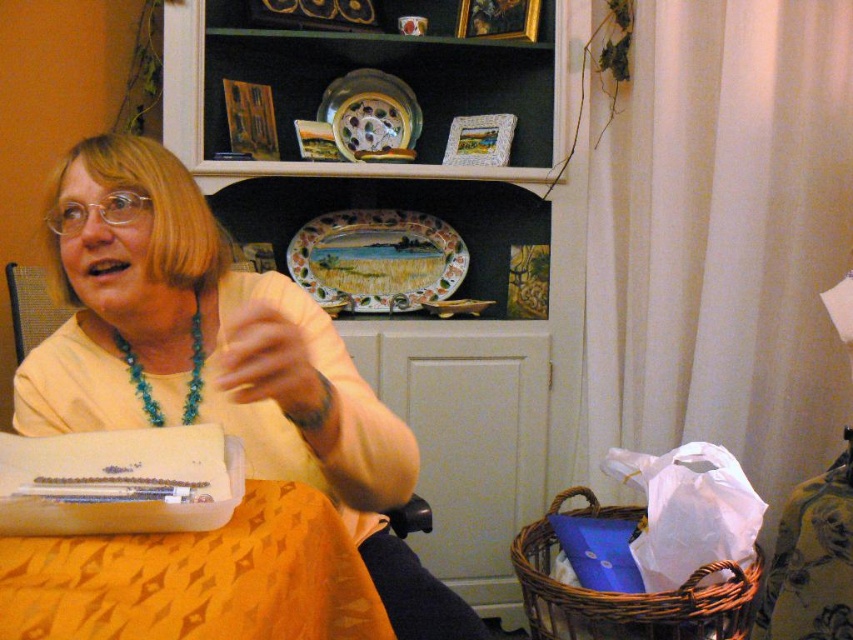
Between point (383, 124) and point (21, 332), which one is positioned in front?

Positioned in front is point (21, 332).

Is glazed ceramic platter at upper center behind metallic mesh chair at left?

Yes.

Who is more forward, (383, 129) or (15, 333)?

Point (15, 333)

Locate an element on the screen. This screenshot has height=640, width=853. glazed ceramic platter at upper center is located at coordinates (370, 115).

Is yellow fabric table at lower left bigger than metallic mesh chair at left?

Correct, yellow fabric table at lower left is larger in size than metallic mesh chair at left.

Who is more forward, (28, 554) or (16, 284)?

Point (28, 554) is in front.

Locate an element on the screen. This screenshot has height=640, width=853. yellow fabric table at lower left is located at coordinates (198, 579).

From the picture: Does yellow matte sweater at center have a lesser width compared to yellow fabric table at lower left?

Incorrect, yellow matte sweater at center's width is not less than yellow fabric table at lower left's.

Which is above, yellow matte sweater at center or yellow fabric table at lower left?

yellow matte sweater at center is higher up.

At what (x,y) coordinates should I click in order to perform the action: click on yellow matte sweater at center. Please return your answer as a coordinate pair (x, y). This screenshot has height=640, width=853. Looking at the image, I should click on (218, 358).

Locate an element on the screen. This screenshot has width=853, height=640. yellow matte sweater at center is located at coordinates (218, 358).